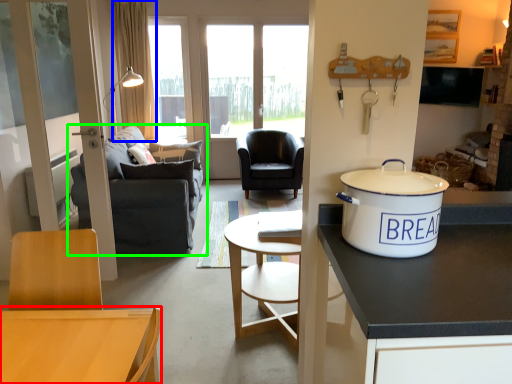
Question: Which object is the closest to the desk (highlighted by a red box)? Choose among these: curtain (highlighted by a blue box) or studio couch (highlighted by a green box).

Choices:
 (A) curtain
 (B) studio couch

Answer: (B)